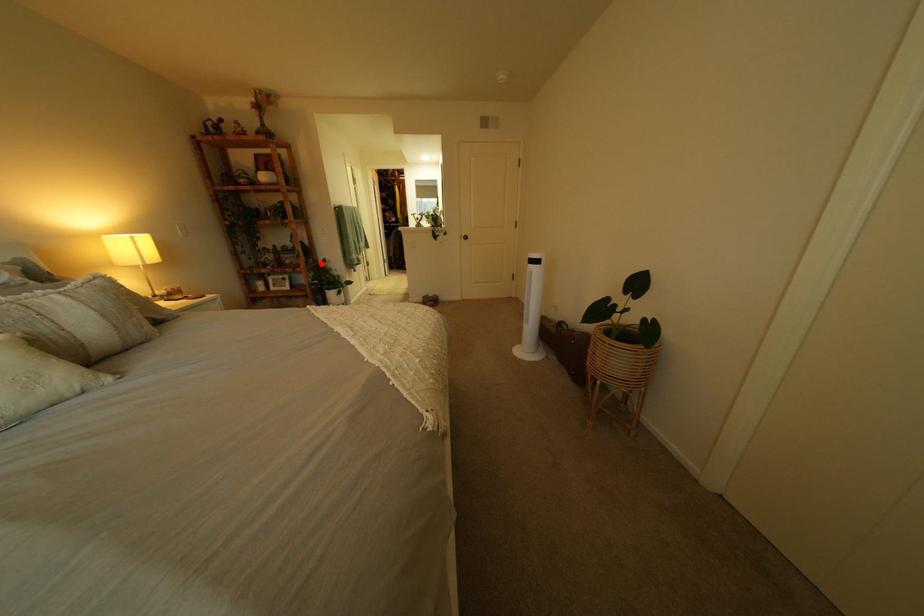
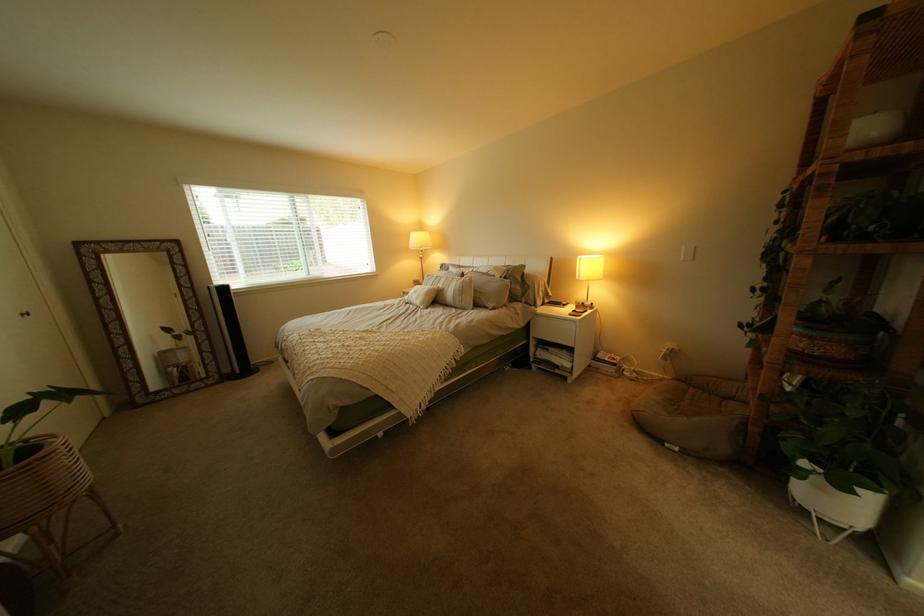
Question: I am providing you with two images of the same scene from different viewpoints. In image1, a red point is highlighted. Considering the same 3D point in image2, which of the following is correct?

Choices:
 (A) It is closer
 (B) It is farther

Answer: (B)